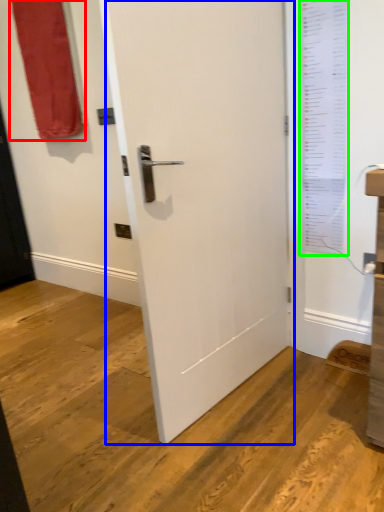
Question: Estimate the real-world distances between objects in this image. Which object is farther from curtain (highlighted by a red box), door (highlighted by a blue box) or window screen (highlighted by a green box)?

Choices:
 (A) door
 (B) window screen

Answer: (B)